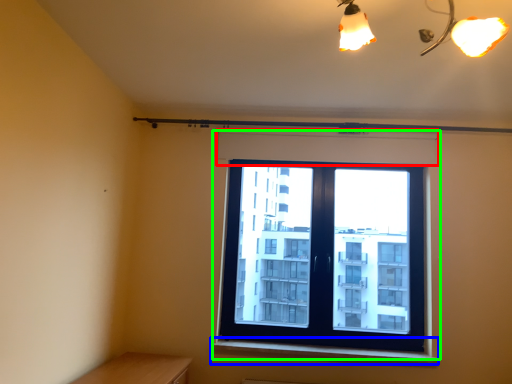
Question: Based on their relative distances, which object is farther from shutter (highlighted by a red box)? Choose from window sill (highlighted by a blue box) and window (highlighted by a green box).

Choices:
 (A) window sill
 (B) window

Answer: (A)